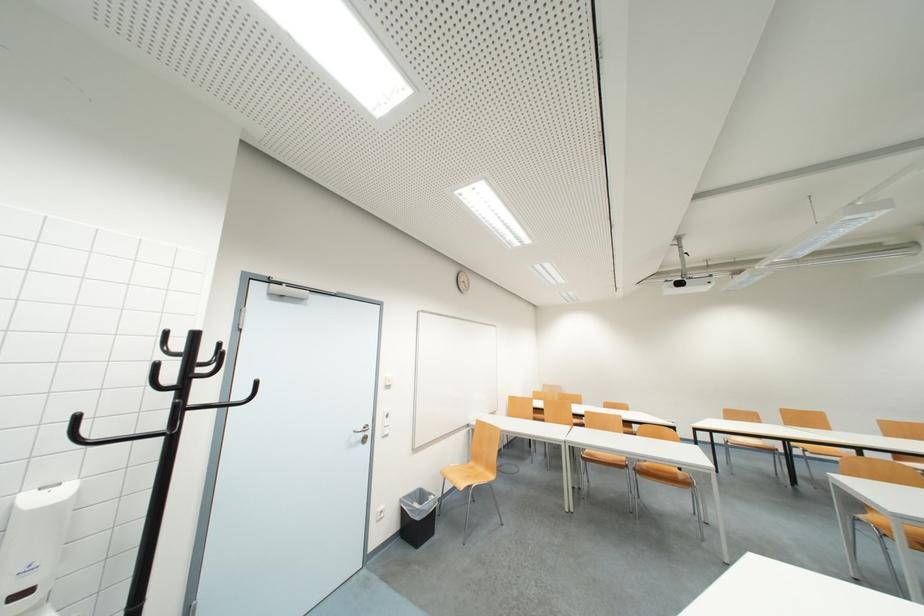
This screenshot has height=616, width=924. What do you see at coordinates (355, 427) in the screenshot?
I see `the silver door handle` at bounding box center [355, 427].